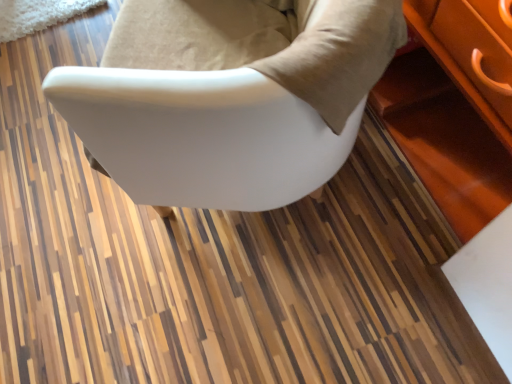
Question: Does white matte chair at center have a greater height compared to white glossy table at lower right?

Choices:
 (A) no
 (B) yes

Answer: (B)

Question: Does white matte chair at center have a lesser width compared to white glossy table at lower right?

Choices:
 (A) yes
 (B) no

Answer: (B)

Question: Is white matte chair at center shorter than white glossy table at lower right?

Choices:
 (A) yes
 (B) no

Answer: (B)

Question: Is white matte chair at center oriented towards white glossy table at lower right?

Choices:
 (A) yes
 (B) no

Answer: (B)

Question: From a real-world perspective, is white matte chair at center on white glossy table at lower right?

Choices:
 (A) yes
 (B) no

Answer: (A)

Question: Is the position of white matte chair at center more distant than that of white glossy table at lower right?

Choices:
 (A) no
 (B) yes

Answer: (A)

Question: From a real-world perspective, is white glossy table at lower right on white matte chair at center?

Choices:
 (A) no
 (B) yes

Answer: (A)

Question: Considering the relative sizes of white glossy table at lower right and white matte chair at center in the image provided, is white glossy table at lower right taller than white matte chair at center?

Choices:
 (A) yes
 (B) no

Answer: (B)

Question: Can you confirm if white glossy table at lower right is shorter than white matte chair at center?

Choices:
 (A) yes
 (B) no

Answer: (A)

Question: From the image's perspective, is white glossy table at lower right over white matte chair at center?

Choices:
 (A) yes
 (B) no

Answer: (B)

Question: Is white glossy table at lower right smaller than white matte chair at center?

Choices:
 (A) yes
 (B) no

Answer: (A)

Question: Does white glossy table at lower right lie in front of white matte chair at center?

Choices:
 (A) yes
 (B) no

Answer: (B)

Question: From a real-world perspective, relative to white glossy table at lower right, is white matte chair at center vertically above or below?

Choices:
 (A) below
 (B) above

Answer: (B)